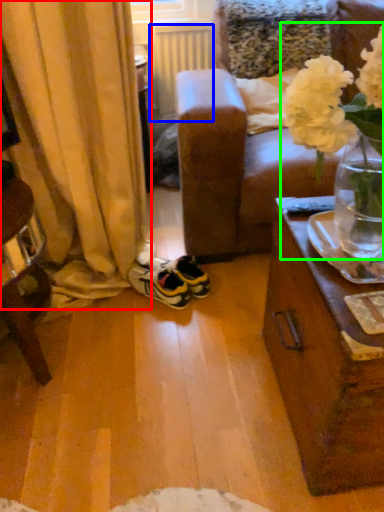
Question: Considering the real-world distances, which object is closest to curtain (highlighted by a red box)? radiator (highlighted by a blue box) or floral arrangement (highlighted by a green box).

Choices:
 (A) radiator
 (B) floral arrangement

Answer: (B)